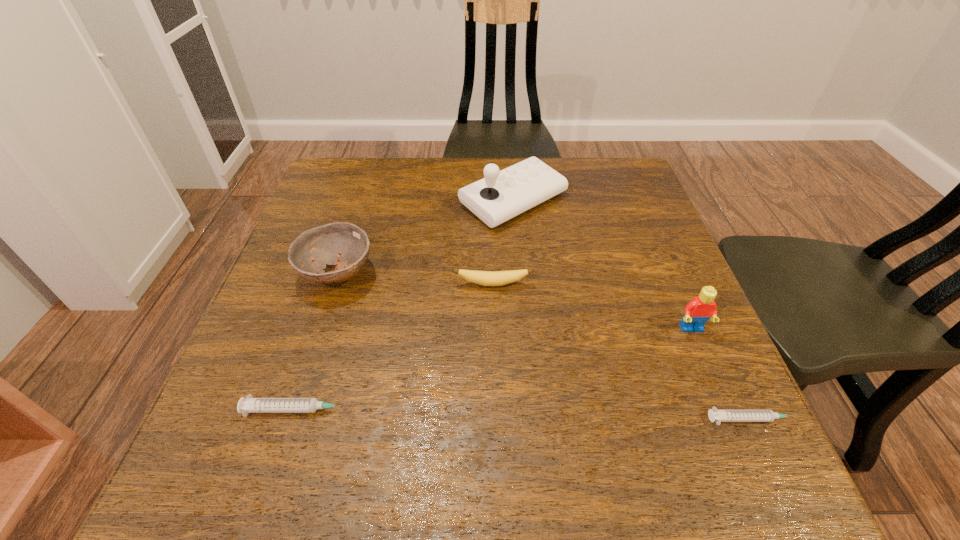
If equal spacing is desired by inserting an extra syringe among them, please point out a free spot for this new syringe. Please provide its 2D coordinates. Your answer should be formatted as a tuple, i.e. [(x, y)], where the tuple contains the x and y coordinates of a point satisfying the conditions above.

[(525, 414)]